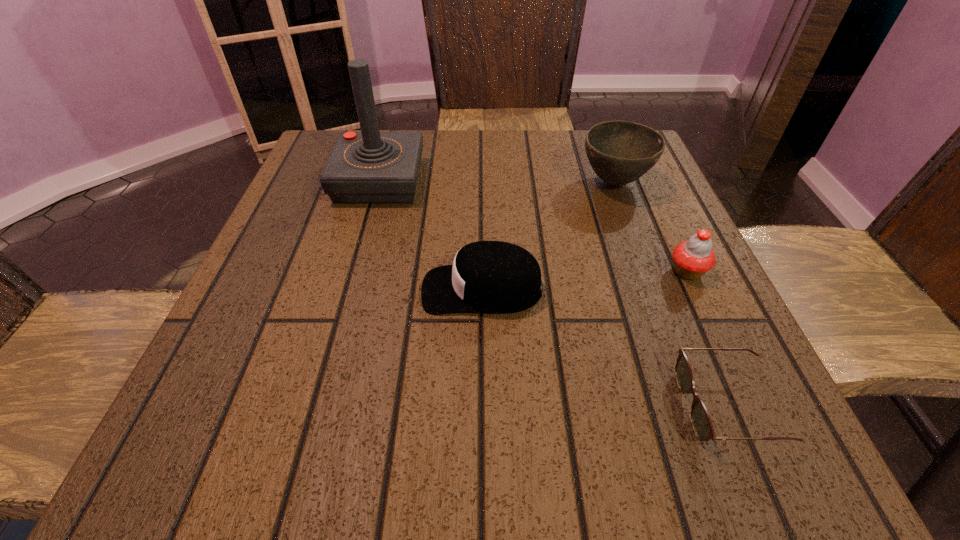
Find the location of `the tallest object`. the tallest object is located at coordinates (369, 167).

Find the location of a particular element. This screenshot has width=960, height=540. the leftmost object is located at coordinates (369, 167).

The height and width of the screenshot is (540, 960). Identify the location of the second tallest object. (620, 152).

At what (x,y) coordinates should I click in order to perform the action: click on cupcake. Please return your answer as a coordinate pair (x, y). The image size is (960, 540). Looking at the image, I should click on (692, 258).

Where is `cap`? The height and width of the screenshot is (540, 960). cap is located at coordinates (486, 276).

The image size is (960, 540). Find the location of `spectacles`. spectacles is located at coordinates (702, 425).

Find the location of a particular element. the shortest object is located at coordinates (702, 425).

I want to click on free spot located on the rectangular base of the leftmost object, so click(x=354, y=273).

The height and width of the screenshot is (540, 960). Identify the location of free space located on the left of the fourth shortest object. (546, 183).

I want to click on vacant space located on the left of the cupcake, so click(478, 272).